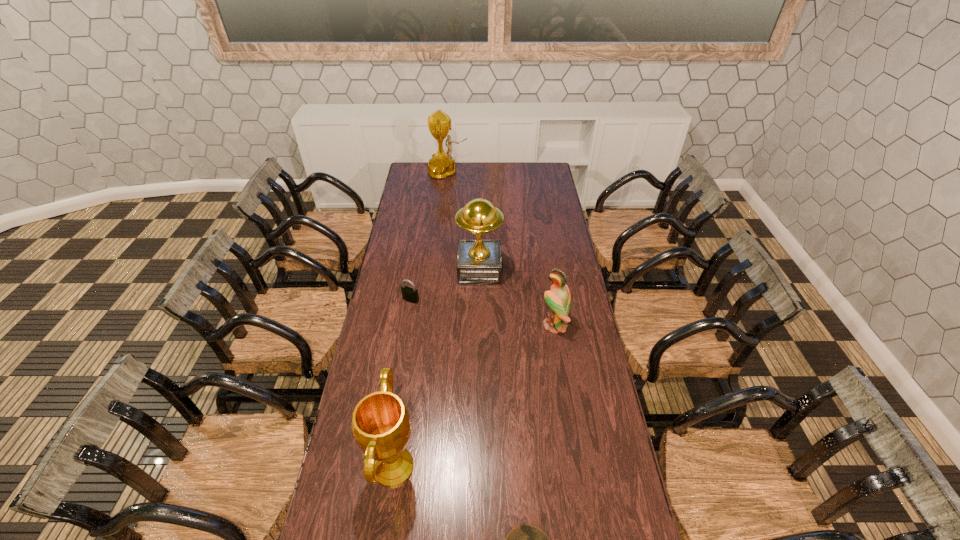
Identify the location of free spot located 0.160m on the front-facing side of the rightmost object. This screenshot has height=540, width=960. (502, 325).

You are a GUI agent. You are given a task and a screenshot of the screen. Output one action in this format:
    pyautogui.click(x=<x>, y=<y>)
    Task: Click on the blank area located on the front-facing side of the rightmost object
    The image size is (960, 540).
    Given the screenshot: What is the action you would take?
    pyautogui.click(x=444, y=325)

Locate an element on the screen. The width and height of the screenshot is (960, 540). vacant space positioned 0.220m on the front-facing side of the rightmost object is located at coordinates (488, 325).

At what (x,y) coordinates should I click in order to perform the action: click on vacant region located 0.100m on the back of the padlock. Please return your answer as a coordinate pair (x, y). The image size is (960, 540). Looking at the image, I should click on (414, 280).

This screenshot has width=960, height=540. I want to click on object that is at the far edge, so click(442, 165).

You are a GUI agent. You are given a task and a screenshot of the screen. Output one action in this format:
    pyautogui.click(x=<x>, y=<y>)
    Task: Click on the padlock that is at the left edge
    Image resolution: width=960 pixels, height=540 pixels.
    Given the screenshot: What is the action you would take?
    pyautogui.click(x=409, y=294)

The height and width of the screenshot is (540, 960). What are the coordinates of `object that is positioned at the right edge` in the screenshot? It's located at (558, 299).

At what (x,y) coordinates should I click in order to perform the action: click on object located in the far left corner section of the desktop. Please return your answer as a coordinate pair (x, y). This screenshot has width=960, height=540. Looking at the image, I should click on (442, 165).

In the image, there is a desktop. Where is `free region at the far edge`? The height and width of the screenshot is (540, 960). free region at the far edge is located at coordinates (490, 175).

Where is `free region at the left edge of the desktop`? free region at the left edge of the desktop is located at coordinates (389, 276).